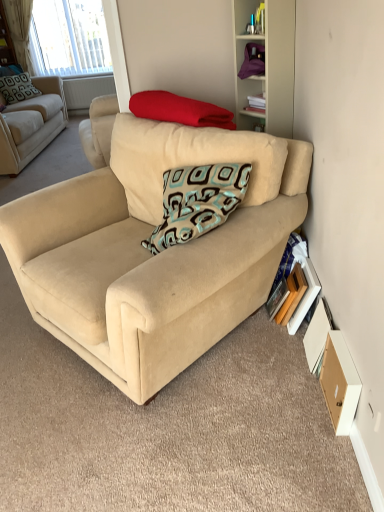
Question: Considering the relative sizes of beige fabric couch at upper left, which ranks as the first studio couch in left-to-right order, and wooden drawer at lower right in the image provided, is beige fabric couch at upper left, which ranks as the first studio couch in left-to-right order, wider than wooden drawer at lower right?

Choices:
 (A) no
 (B) yes

Answer: (B)

Question: Is beige fabric couch at upper left, the 1th studio couch when ordered from top to bottom, facing away from wooden drawer at lower right?

Choices:
 (A) no
 (B) yes

Answer: (A)

Question: Could you tell me if beige fabric couch at upper left, positioned as the first studio couch in back-to-front order, is facing wooden drawer at lower right?

Choices:
 (A) yes
 (B) no

Answer: (B)

Question: Considering the relative positions of beige fabric couch at upper left, the 1th studio couch when ordered from top to bottom, and wooden drawer at lower right in the image provided, is beige fabric couch at upper left, the 1th studio couch when ordered from top to bottom, to the left of wooden drawer at lower right from the viewer's perspective?

Choices:
 (A) no
 (B) yes

Answer: (B)

Question: Does beige fabric couch at upper left, marked as the 2th studio couch in a front-to-back arrangement, contain wooden drawer at lower right?

Choices:
 (A) no
 (B) yes

Answer: (A)

Question: Does beige fabric couch at upper left, which is counted as the second studio couch, starting from the bottom, have a lesser height compared to wooden drawer at lower right?

Choices:
 (A) yes
 (B) no

Answer: (B)

Question: Is white matte cabinet at upper right completely or partially outside of wooden paperback book at lower right, the 2th paperback book positioned from the right?

Choices:
 (A) no
 (B) yes

Answer: (B)

Question: Is the position of white matte cabinet at upper right less distant than that of wooden paperback book at lower right, the 2th paperback book positioned from the right?

Choices:
 (A) yes
 (B) no

Answer: (A)

Question: Can you confirm if white matte cabinet at upper right is bigger than wooden paperback book at lower right, the 2th paperback book positioned from the right?

Choices:
 (A) yes
 (B) no

Answer: (A)

Question: Is white matte cabinet at upper right far from wooden paperback book at lower right, which appears as the first paperback book when viewed from the left?

Choices:
 (A) no
 (B) yes

Answer: (A)

Question: From the image's perspective, is white matte cabinet at upper right over wooden paperback book at lower right, which appears as the first paperback book when viewed from the left?

Choices:
 (A) yes
 (B) no

Answer: (A)

Question: From the image's perspective, is white matte cabinet at upper right located beneath wooden paperback book at lower right, which appears as the first paperback book when viewed from the left?

Choices:
 (A) no
 (B) yes

Answer: (A)

Question: Does wooden drawer at lower right have a lesser height compared to teal-patterned fabric pillow at upper left, which is the first pillow in back-to-front order?

Choices:
 (A) no
 (B) yes

Answer: (B)